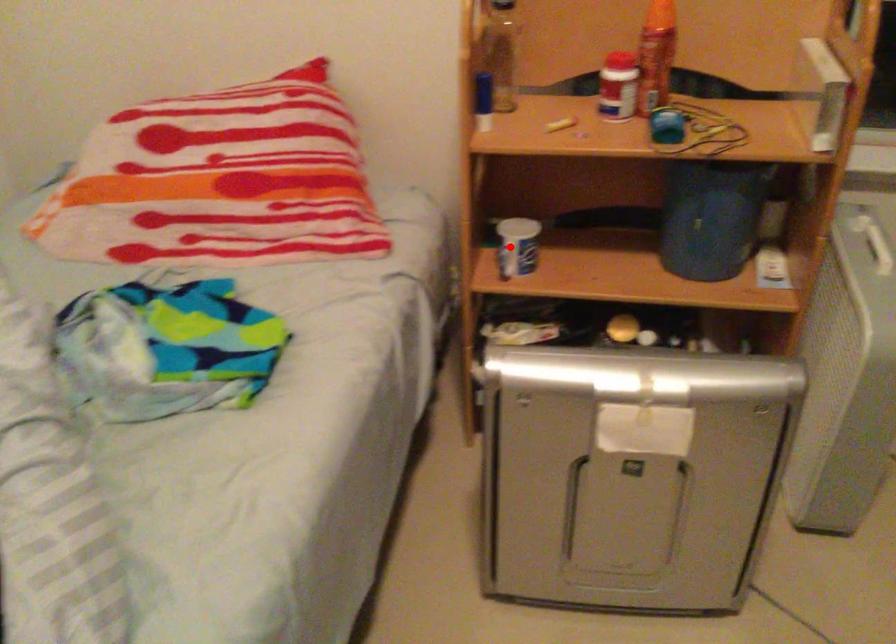
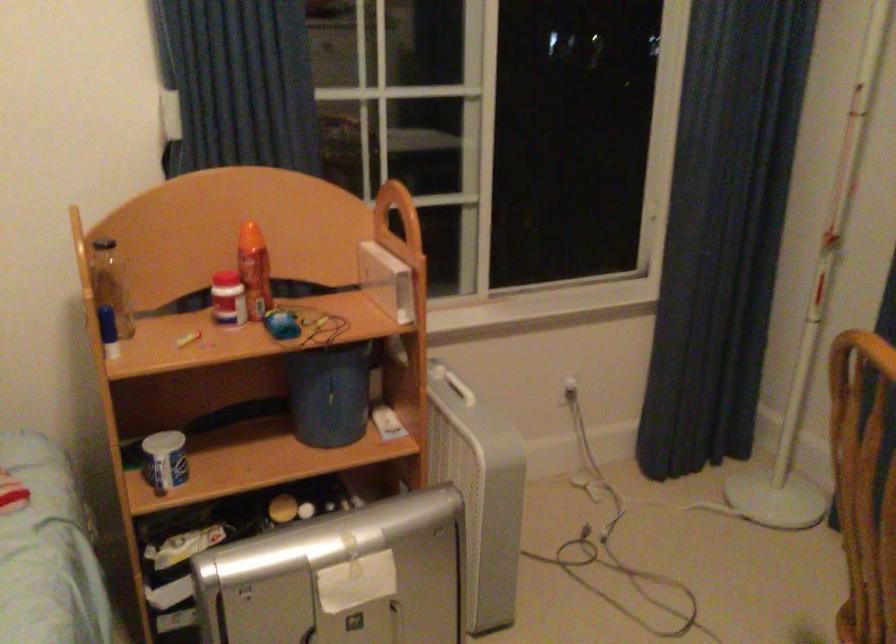
In the second image, find the point that corresponds to the highlighted location in the first image.

(165, 460)